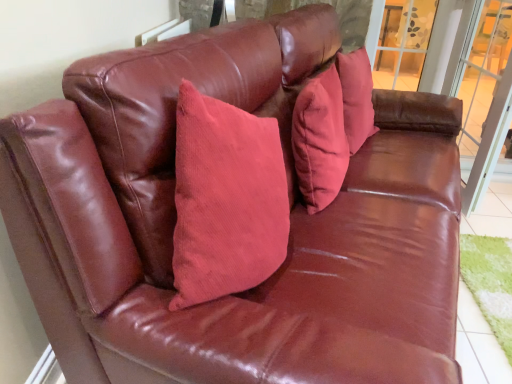
Identify the location of corduroy pillow at center. (320, 140).

The width and height of the screenshot is (512, 384). Find the location of `corduroy pillow at center`. corduroy pillow at center is located at coordinates (320, 140).

Would you say transparent glass screen door at right is a long distance from corduroy pillow at center?

transparent glass screen door at right is near corduroy pillow at center, not far away.

Based on the photo, does transparent glass screen door at right have a larger size compared to corduroy pillow at center?

Indeed, transparent glass screen door at right has a larger size compared to corduroy pillow at center.

How different are the orientations of transparent glass screen door at right and corduroy pillow at center in degrees?

18.2 degrees separate the facing orientations of transparent glass screen door at right and corduroy pillow at center.

Which object is wider, corduroy pillow at center or clear glass window at upper right?

With larger width is clear glass window at upper right.

Is corduroy pillow at center shorter than clear glass window at upper right?

Correct, corduroy pillow at center is not as tall as clear glass window at upper right.

From a real-world perspective, who is located lower, corduroy pillow at center or clear glass window at upper right?

clear glass window at upper right, from a real-world perspective.

Consider the image. Which object is further away from the camera taking this photo, clear glass window at upper right or transparent glass screen door at right?

clear glass window at upper right is further from the camera.

Is clear glass window at upper right smaller than transparent glass screen door at right?

Actually, clear glass window at upper right might be larger than transparent glass screen door at right.

Looking at this image, from the image's perspective, is clear glass window at upper right positioned above or below transparent glass screen door at right?

From the image's perspective, clear glass window at upper right appears above transparent glass screen door at right.

Considering the relative positions of clear glass window at upper right and transparent glass screen door at right in the image provided, is clear glass window at upper right to the left or to the right of transparent glass screen door at right?

In the image, clear glass window at upper right appears on the right side of transparent glass screen door at right.

Considering the positions of objects corduroy pillow at center and transparent glass screen door at right in the image provided, who is more to the right, corduroy pillow at center or transparent glass screen door at right?

From the viewer's perspective, transparent glass screen door at right appears more on the right side.

Is the surface of corduroy pillow at center in direct contact with transparent glass screen door at right?

No, corduroy pillow at center is not in contact with transparent glass screen door at right.

From a real-world perspective, relative to transparent glass screen door at right, is corduroy pillow at center vertically above or below?

Clearly, from a real-world perspective, corduroy pillow at center is above transparent glass screen door at right.

Is corduroy pillow at center aimed at transparent glass screen door at right?

No, corduroy pillow at center is not oriented towards transparent glass screen door at right.

From a real-world perspective, is transparent glass screen door at right below clear glass window at upper right?

No.

From the image's perspective, which is above, transparent glass screen door at right or clear glass window at upper right?

clear glass window at upper right.

What's the angular difference between transparent glass screen door at right and clear glass window at upper right's facing directions?

90 degrees separate the facing orientations of transparent glass screen door at right and clear glass window at upper right.

Locate an element on the screen. window below the transparent glass screen door at right (from a real-world perspective) is located at coordinates (403, 43).

Would you say corduroy pillow at center is part of clear glass window at upper right's contents?

Actually, corduroy pillow at center is outside clear glass window at upper right.

Considering the relative sizes of clear glass window at upper right and corduroy pillow at center in the image provided, is clear glass window at upper right thinner than corduroy pillow at center?

No, clear glass window at upper right is not thinner than corduroy pillow at center.

Is clear glass window at upper right positioned behind corduroy pillow at center?

Yes, it is.

Identify the location of pillow that is on the left side of transparent glass screen door at right. This screenshot has width=512, height=384. (320, 140).

Where is `window behind the corduroy pillow at center`? The height and width of the screenshot is (384, 512). window behind the corduroy pillow at center is located at coordinates (403, 43).

From the image, which object appears to be farther from clear glass window at upper right, corduroy pillow at center or transparent glass screen door at right?

corduroy pillow at center.

Considering their positions, is transparent glass screen door at right positioned further to corduroy pillow at center than clear glass window at upper right?

clear glass window at upper right.

Which object lies nearer to the anchor point corduroy pillow at center, clear glass window at upper right or transparent glass screen door at right?

transparent glass screen door at right lies closer to corduroy pillow at center than the other object.

When comparing their distances from transparent glass screen door at right, does clear glass window at upper right or corduroy pillow at center seem closer?

The object closer to transparent glass screen door at right is clear glass window at upper right.

Estimate the real-world distances between objects in this image. Which object is further from transparent glass screen door at right, corduroy pillow at center or clear glass window at upper right?

The object further to transparent glass screen door at right is corduroy pillow at center.

Estimate the real-world distances between objects in this image. Which object is closer to clear glass window at upper right, transparent glass screen door at right or corduroy pillow at center?

transparent glass screen door at right lies closer to clear glass window at upper right than the other object.

Locate an element on the screen. This screenshot has width=512, height=384. screen door positioned between corduroy pillow at center and clear glass window at upper right from near to far is located at coordinates (486, 100).